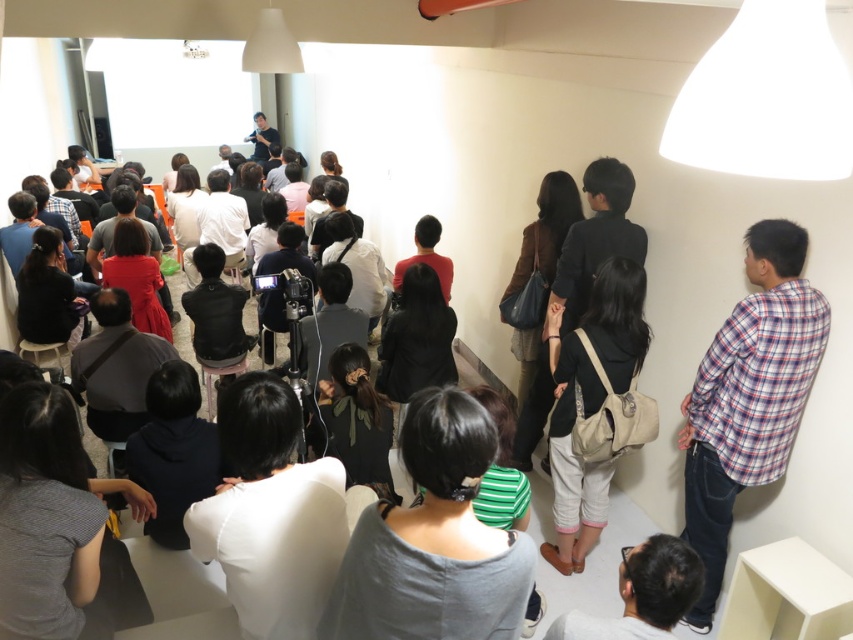
Question: Considering the real-world distances, which object is farthest from the black matte bag at center?

Choices:
 (A) plaid fabric shirt at right
 (B) gray matte shirt at center

Answer: (B)

Question: Estimate the real-world distances between objects in this image. Which object is closer to the black matte bag at center?

Choices:
 (A) gray matte shirt at center
 (B) plaid fabric shirt at right

Answer: (B)

Question: Which of the following is the farthest from the observer?

Choices:
 (A) black matte bag at center
 (B) plaid fabric shirt at right

Answer: (A)

Question: Is plaid fabric shirt at right wider than black matte bag at center?

Choices:
 (A) yes
 (B) no

Answer: (A)

Question: Is gray matte shirt at center wider than black matte bag at center?

Choices:
 (A) yes
 (B) no

Answer: (A)

Question: Does gray matte shirt at center have a lesser width compared to plaid fabric shirt at right?

Choices:
 (A) no
 (B) yes

Answer: (A)